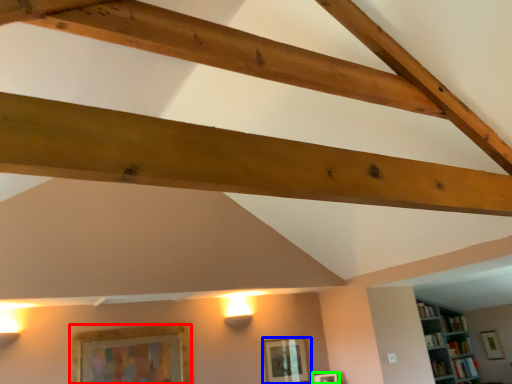
Question: Estimate the real-world distances between objects in this image. Which object is farther from picture frame (highlighted by a red box), picture frame (highlighted by a blue box) or picture frame (highlighted by a green box)?

Choices:
 (A) picture frame
 (B) picture frame

Answer: (B)